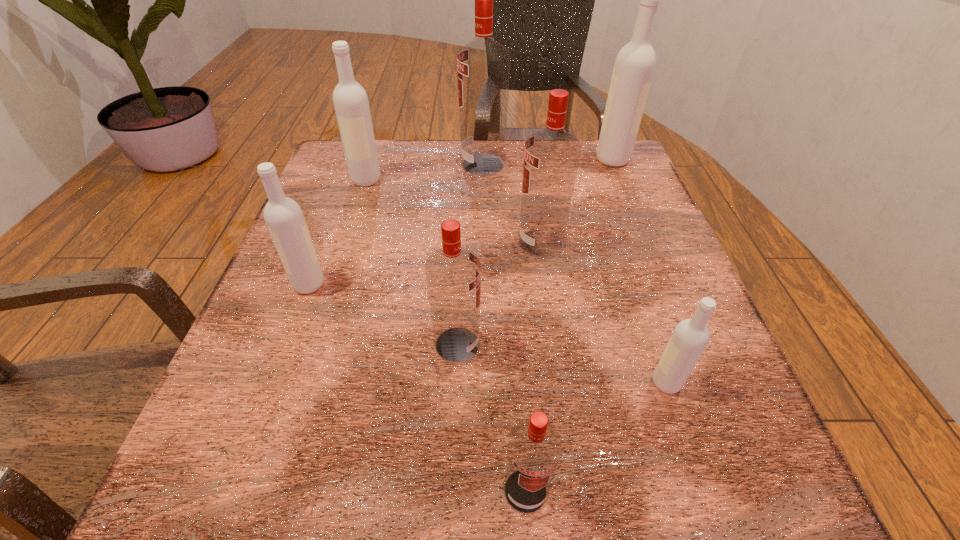
Locate an element on the screen. the second nearest vodka is located at coordinates (690, 337).

Identify the location of the nearest object. The width and height of the screenshot is (960, 540). click(x=534, y=448).

In order to click on the nearest vodka in this screenshot , I will do `click(534, 448)`.

Identify the location of vacant space located on the front label of the biggest red vodka. This screenshot has height=540, width=960. (349, 165).

At what (x,y) coordinates should I click in order to perform the action: click on vacant space situated 0.280m on the front label of the biggest red vodka. Please return your answer as a coordinate pair (x, y). The width and height of the screenshot is (960, 540). Looking at the image, I should click on (346, 165).

This screenshot has height=540, width=960. Find the location of `vacant region located 0.190m on the front label of the biggest red vodka`. vacant region located 0.190m on the front label of the biggest red vodka is located at coordinates (382, 165).

This screenshot has height=540, width=960. I want to click on vacant area situated 0.330m on the front of the farthest white vodka, so click(655, 261).

Locate an element on the screen. Image resolution: width=960 pixels, height=540 pixels. vacant space located 0.160m on the front label of the second farthest red vodka is located at coordinates (436, 243).

Identify the location of vacant space located on the front label of the second farthest red vodka. The width and height of the screenshot is (960, 540). (406, 243).

The image size is (960, 540). I want to click on vacant area located on the front label of the second farthest red vodka, so click(x=431, y=243).